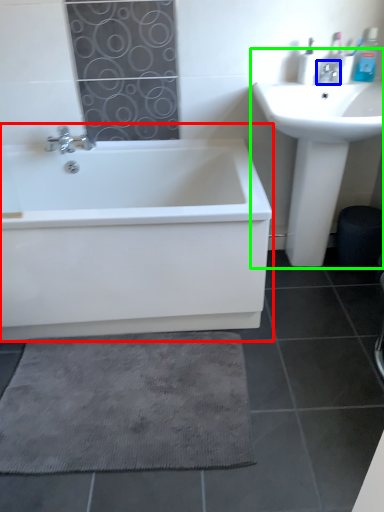
Question: Considering the real-world distances, which object is closest to bathtub (highlighted by a red box)? tap (highlighted by a blue box) or sink (highlighted by a green box).

Choices:
 (A) tap
 (B) sink

Answer: (B)